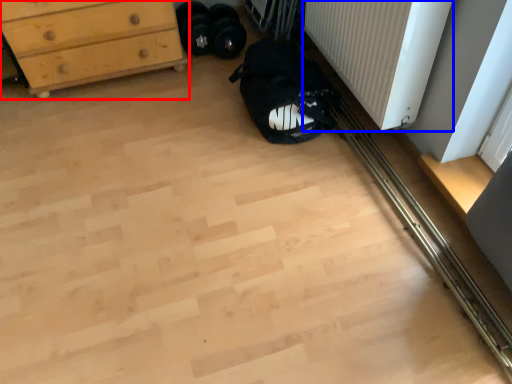
Question: Which object is closer to the camera taking this photo, chest of drawers (highlighted by a red box) or radiator (highlighted by a blue box)?

Choices:
 (A) chest of drawers
 (B) radiator

Answer: (B)